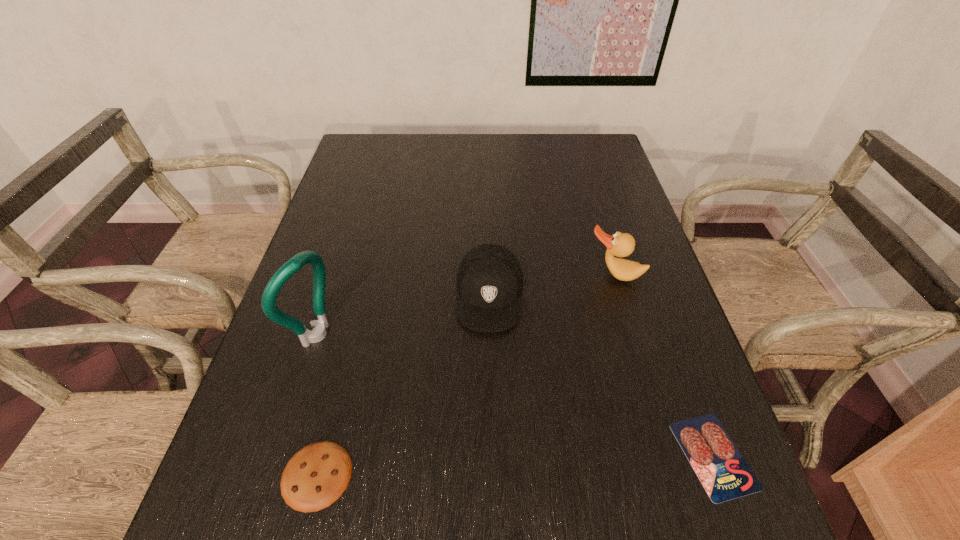
The image size is (960, 540). Find the location of `bottle opener that is positioned at the left edge`. bottle opener that is positioned at the left edge is located at coordinates (285, 272).

The height and width of the screenshot is (540, 960). In order to click on salami that is positioned at the right edge in this screenshot , I will do `click(724, 473)`.

Where is `duck that is at the right edge`? duck that is at the right edge is located at coordinates (620, 244).

Find the location of a particular element. object that is positioned at the near left corner is located at coordinates (316, 476).

Identify the location of object located in the near right corner section of the desktop. Image resolution: width=960 pixels, height=540 pixels. coord(724,473).

You are a GUI agent. You are given a task and a screenshot of the screen. Output one action in this format:
    pyautogui.click(x=<x>, y=<y>)
    Task: Click on the free space at the far edge of the desktop
    The width and height of the screenshot is (960, 540).
    Given the screenshot: What is the action you would take?
    pyautogui.click(x=477, y=147)

At what (x,y) coordinates should I click in order to perform the action: click on vacant space at the near edge. Please return your answer as a coordinate pair (x, y). This screenshot has width=960, height=540. Looking at the image, I should click on (538, 444).

Where is `free region at the left edge`? Image resolution: width=960 pixels, height=540 pixels. free region at the left edge is located at coordinates (338, 188).

Identify the location of vacant space at the right edge. (632, 230).

Find the location of a particular element. This screenshot has width=960, height=540. vacant position at the far left corner of the desktop is located at coordinates (393, 150).